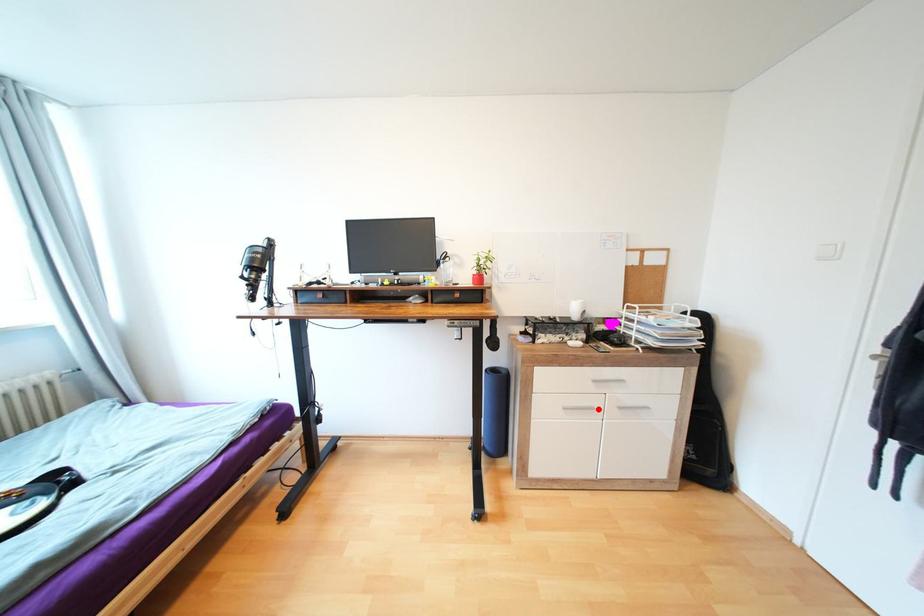
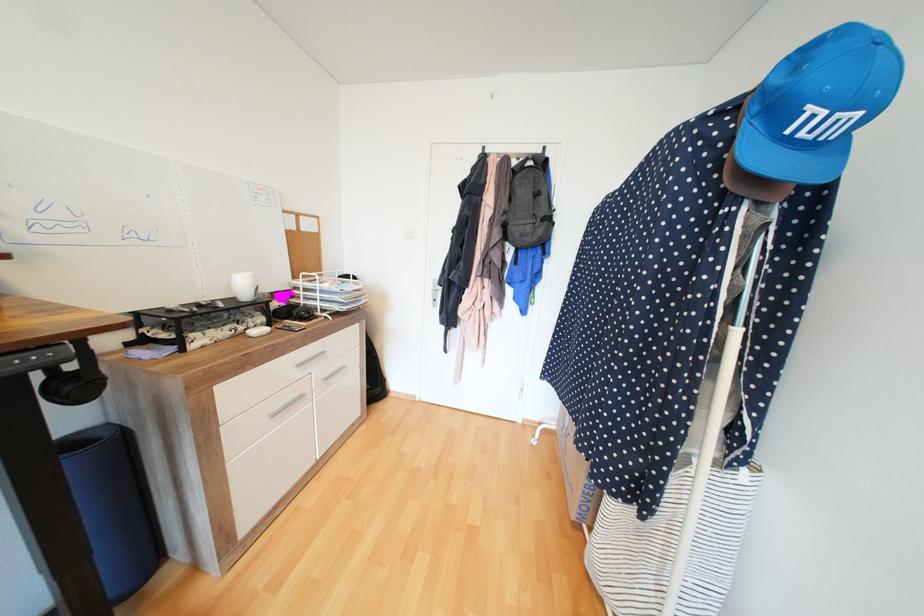
Where in the second image is the point corresponding to the highlighted location from the first image?

(309, 395)